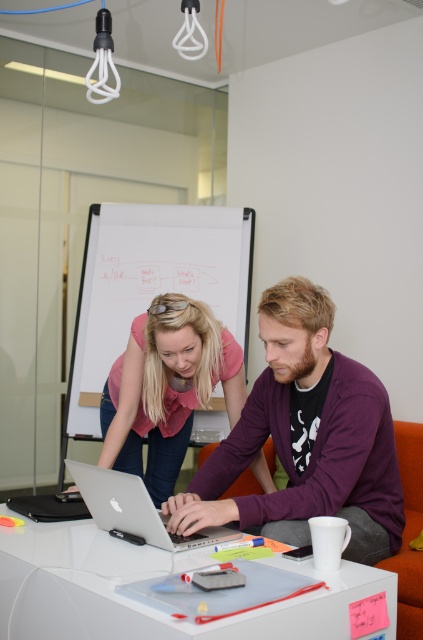
Question: Which object is positioned closest to the white plastic table at center?

Choices:
 (A) silver metallic laptop at center
 (B) purple matte shirt at center

Answer: (A)

Question: Which point is farther to the camera?

Choices:
 (A) (296, 305)
 (B) (172, 560)

Answer: (A)

Question: Does purple matte shirt at center have a greater width compared to silver metallic laptop at center?

Choices:
 (A) yes
 (B) no

Answer: (A)

Question: Can you confirm if purple matte shirt at center is wider than white plastic table at center?

Choices:
 (A) no
 (B) yes

Answer: (A)

Question: Does purple matte shirt at center have a lesser width compared to white plastic table at center?

Choices:
 (A) yes
 (B) no

Answer: (A)

Question: Which point is farther to the camera?

Choices:
 (A) click(x=390, y=419)
 (B) click(x=123, y=493)

Answer: (A)